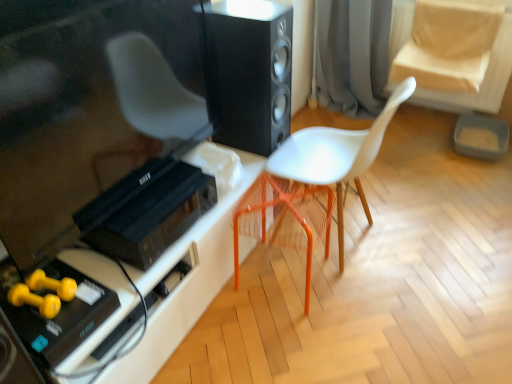
Locate an element on the screen. Image resolution: width=512 pixels, height=384 pixels. white plastic table at lower left is located at coordinates (185, 281).

Measure the distance between point (x=307, y=158) and camera.

Point (x=307, y=158) and camera are 1.89 meters apart from each other.

The width and height of the screenshot is (512, 384). I want to click on black matte speaker at center, so click(248, 72).

The image size is (512, 384). Describe the element at coordinates (284, 218) in the screenshot. I see `orange plastic swivel chair at center` at that location.

Find the location of a particular element. black plastic stereo at lower left is located at coordinates (147, 211).

In order to click on gray fabric curtain at upper center in this screenshot , I will do `click(353, 55)`.

What is the approximate height of gray fabric curtain at upper center?

33.93 inches.

Identify the location of white plastic table at lower left. (185, 281).

Does orange plastic swivel chair at center have a lesser width compared to black plastic stereo at lower left?

Indeed, orange plastic swivel chair at center has a lesser width compared to black plastic stereo at lower left.

Looking at this image, what's the angular difference between orange plastic swivel chair at center and black plastic stereo at lower left's facing directions?

7.43 degrees.

Is orange plastic swivel chair at center looking in the opposite direction of black plastic stereo at lower left?

A: Absolutely, orange plastic swivel chair at center is directed away from black plastic stereo at lower left.

Considering the relative sizes of orange plastic swivel chair at center and black plastic stereo at lower left in the image provided, is orange plastic swivel chair at center bigger than black plastic stereo at lower left?

Yes.

Considering the relative positions of white plastic table at lower left and black matte speaker at center in the image provided, is white plastic table at lower left to the left or to the right of black matte speaker at center?

From the image, it's evident that white plastic table at lower left is to the left of black matte speaker at center.

Is white plastic table at lower left taller than black matte speaker at center?

No, white plastic table at lower left is not taller than black matte speaker at center.

Is black matte speaker at center at the back of white plastic table at lower left?

No, black matte speaker at center is not at the back of white plastic table at lower left.

Is point (155, 348) less distant than point (248, 127)?

Yes, point (155, 348) is closer to viewer.

In terms of height, does white plastic table at lower left look taller or shorter compared to orange plastic swivel chair at center?

In the image, white plastic table at lower left appears to be shorter than orange plastic swivel chair at center.

From the image's perspective, which object appears higher, white plastic table at lower left or orange plastic swivel chair at center?

From the image's view, orange plastic swivel chair at center is above.

Considering the positions of objects white plastic table at lower left and orange plastic swivel chair at center in the image provided, who is behind, white plastic table at lower left or orange plastic swivel chair at center?

orange plastic swivel chair at center is behind.

From a real-world perspective, which object stands above the other?

From a 3D spatial view, orange plastic swivel chair at center is above.

Can you tell me how much white plastic table at lower left and white matte chair at center differ in facing direction?

179 degrees separate the facing orientations of white plastic table at lower left and white matte chair at center.

Are white plastic table at lower left and white matte chair at center far apart?

No.

Considering the sizes of objects white plastic table at lower left and white matte chair at center in the image provided, who is wider, white plastic table at lower left or white matte chair at center?

white matte chair at center is wider.

Would you say white plastic table at lower left is to the left or to the right of white matte chair at center in the picture?

white plastic table at lower left is to the left of white matte chair at center.

Locate an element on the screen. This screenshot has height=384, width=512. table below the white matte chair at center (from the image's perspective) is located at coordinates (185, 281).

Is white matte chair at center inside the boundaries of white plastic table at lower left, or outside?

white matte chair at center lies outside white plastic table at lower left.

Can you tell me how much white matte chair at center and white plastic table at lower left differ in facing direction?

The angular difference between white matte chair at center and white plastic table at lower left is 179 degrees.

Considering the positions of objects white matte chair at center and white plastic table at lower left in the image provided, who is more to the left, white matte chair at center or white plastic table at lower left?

Positioned to the left is white plastic table at lower left.

What's the angular difference between gray fabric curtain at upper center and black plastic stereo at lower left's facing directions?

gray fabric curtain at upper center and black plastic stereo at lower left are facing 91.7 degrees away from each other.

Consider the image. Considering the relative sizes of gray fabric curtain at upper center and black plastic stereo at lower left in the image provided, is gray fabric curtain at upper center wider than black plastic stereo at lower left?

Indeed, gray fabric curtain at upper center has a greater width compared to black plastic stereo at lower left.

Does gray fabric curtain at upper center appear on the right side of black plastic stereo at lower left?

Yes, gray fabric curtain at upper center is to the right of black plastic stereo at lower left.

In the scene shown: Is gray fabric curtain at upper center not close to white matte chair at center?

Indeed, gray fabric curtain at upper center is not near white matte chair at center.

Consider the image. From the image's perspective, is gray fabric curtain at upper center on white matte chair at center?

Yes, from the image's perspective, gray fabric curtain at upper center is above white matte chair at center.

Is point (332, 35) farther from viewer compared to point (389, 121)?

Yes.

The width and height of the screenshot is (512, 384). I want to click on swivel chair below the black plastic stereo at lower left (from the image's perspective), so click(x=284, y=218).

Find the location of a particular element. table that appears in front of the black matte speaker at center is located at coordinates (185, 281).

Looking at the image, which one is located further to black matte speaker at center, gray fabric curtain at upper center or white matte chair at center?

The object further to black matte speaker at center is gray fabric curtain at upper center.

Estimate the real-world distances between objects in this image. Which object is closer to white plastic table at lower left, orange plastic swivel chair at center or black matte speaker at center?

Among the two, orange plastic swivel chair at center is located nearer to white plastic table at lower left.

When comparing their distances from black matte speaker at center, does black plastic stereo at lower left or orange plastic swivel chair at center seem closer?

orange plastic swivel chair at center is closer to black matte speaker at center.

Looking at the image, which one is located closer to gray fabric curtain at upper center, white plastic table at lower left or white matte chair at center?

Based on the image, white matte chair at center appears to be nearer to gray fabric curtain at upper center.

Considering their positions, is black matte speaker at center positioned closer to white plastic table at lower left than white matte chair at center?

The object closer to white plastic table at lower left is white matte chair at center.

Looking at the image, which one is located closer to gray fabric curtain at upper center, white matte chair at center or white plastic table at lower left?

white matte chair at center is closer to gray fabric curtain at upper center.

From the image, which object appears to be farther from black plastic stereo at lower left, black matte speaker at center or gray fabric curtain at upper center?

gray fabric curtain at upper center.

When comparing their distances from white plastic table at lower left, does gray fabric curtain at upper center or white matte chair at center seem further?

The object further to white plastic table at lower left is gray fabric curtain at upper center.

What are the coordinates of `chair between black matte speaker at center and orange plastic swivel chair at center in the up-down direction` in the screenshot? It's located at (311, 186).

Where is `table between black plastic stereo at lower left and white matte chair at center`? The image size is (512, 384). table between black plastic stereo at lower left and white matte chair at center is located at coordinates (185, 281).

At what (x,y) coordinates should I click in order to perform the action: click on chair between black plastic stereo at lower left and gray fabric curtain at upper center along the z-axis. Please return your answer as a coordinate pair (x, y). The height and width of the screenshot is (384, 512). Looking at the image, I should click on (311, 186).

Image resolution: width=512 pixels, height=384 pixels. Find the location of `stereo between white plastic table at lower left and gray fabric curtain at upper center in the front-back direction`. stereo between white plastic table at lower left and gray fabric curtain at upper center in the front-back direction is located at coordinates (147, 211).